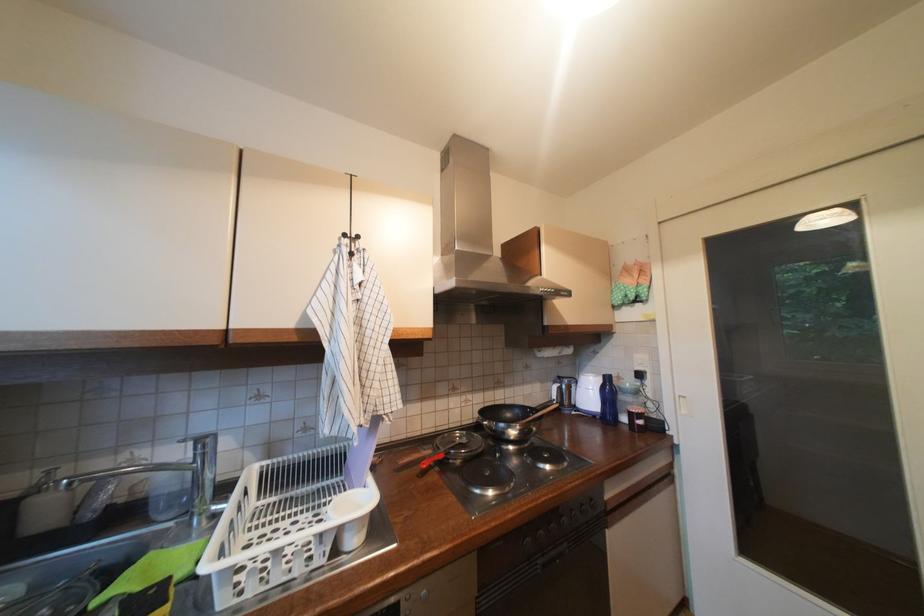
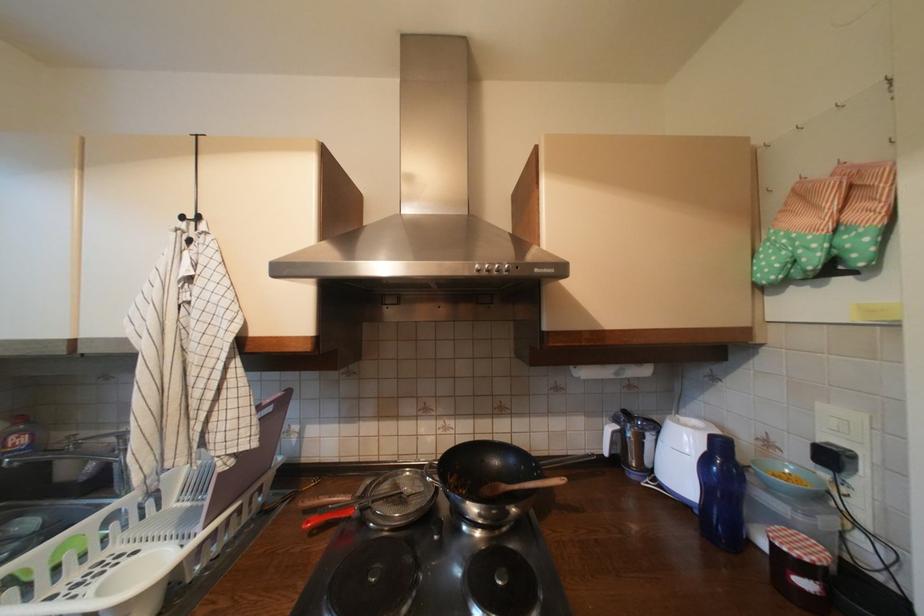
The point at (432, 464) is marked in the first image. Where is the corresponding point in the second image?

(317, 524)